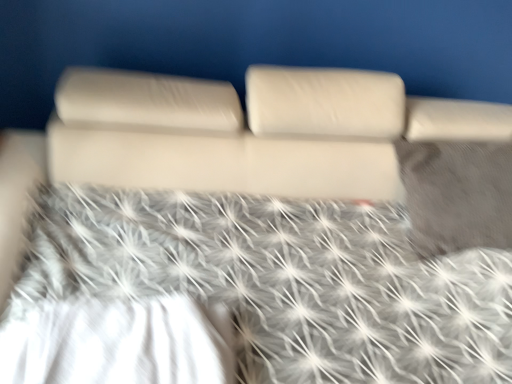
Question: Should I look upward or downward to see satin fabric pillow at right?

Choices:
 (A) up
 (B) down

Answer: (A)